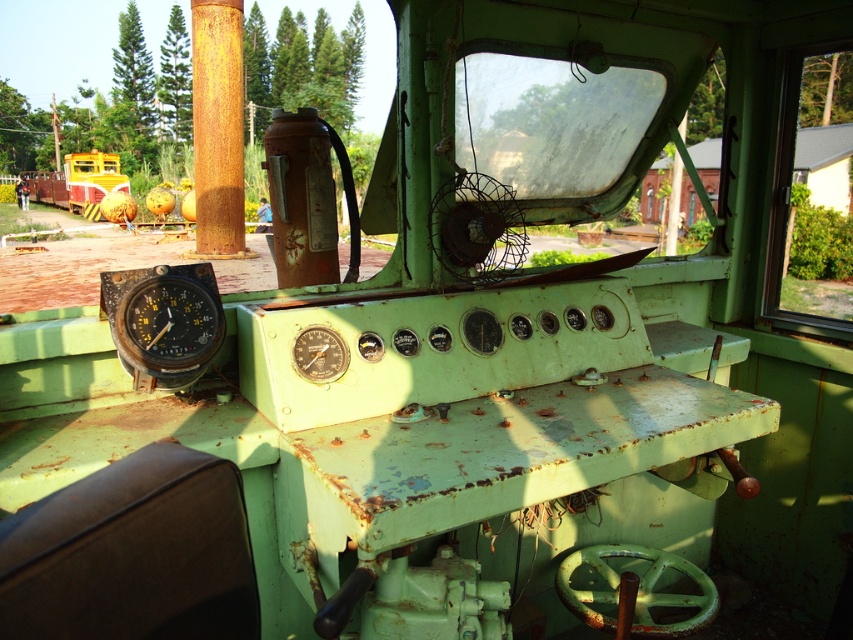
Question: Does yellow painted metal train at left have a larger size compared to matte black gauge at center?

Choices:
 (A) yes
 (B) no

Answer: (A)

Question: Among these points, which one is nearest to the camera?

Choices:
 (A) (340, 340)
 (B) (90, 192)

Answer: (A)

Question: Which point appears farthest from the camera in this image?

Choices:
 (A) (91, 180)
 (B) (340, 342)

Answer: (A)

Question: Does yellow painted metal train at left appear under matte black gauge at center?

Choices:
 (A) no
 (B) yes

Answer: (A)

Question: Is yellow painted metal train at left to the right of matte black gauge at center from the viewer's perspective?

Choices:
 (A) no
 (B) yes

Answer: (A)